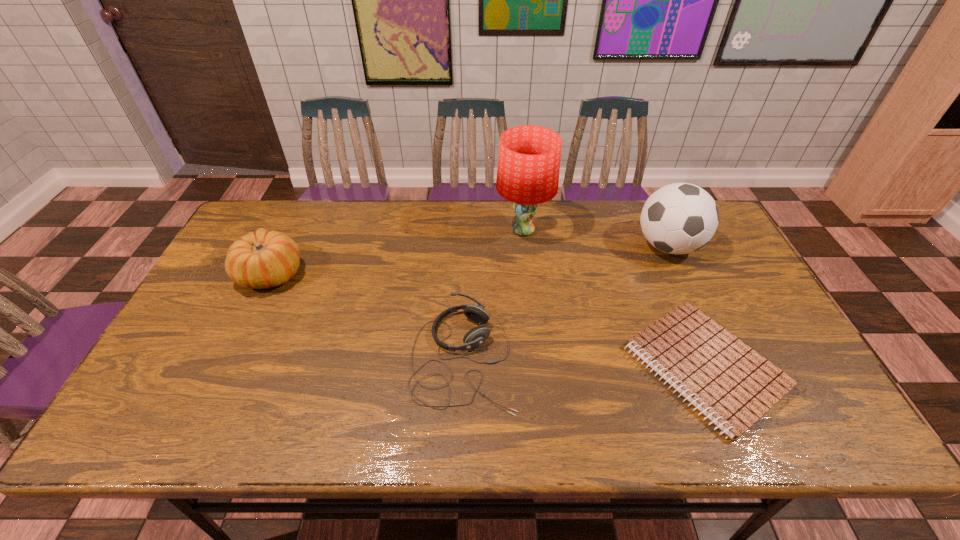
Locate an element on the screen. lampshade is located at coordinates (529, 158).

At what (x,y) coordinates should I click in order to perform the action: click on soccer ball. Please return your answer as a coordinate pair (x, y). This screenshot has height=540, width=960. Looking at the image, I should click on (680, 218).

Identify the location of the third tallest object. The height and width of the screenshot is (540, 960). (264, 259).

Image resolution: width=960 pixels, height=540 pixels. Find the location of `gourd`. gourd is located at coordinates (264, 259).

The width and height of the screenshot is (960, 540). Find the location of `headset`. headset is located at coordinates (478, 335).

You are a GUI agent. You are given a task and a screenshot of the screen. Output one action in this format:
    pyautogui.click(x=<x>, y=<y>)
    Task: Click on the notebook
    The height and width of the screenshot is (540, 960).
    Given the screenshot: What is the action you would take?
    pyautogui.click(x=732, y=385)

Where is `vacant space located on the front-facing side of the tallest object`? This screenshot has width=960, height=540. vacant space located on the front-facing side of the tallest object is located at coordinates (420, 230).

I want to click on vacant space located on the front-facing side of the tallest object, so click(x=441, y=230).

Identify the location of free spot located 0.140m on the front-facing side of the tallest object. (452, 230).

Where is `vacant space located on the left of the soccer ball`? The image size is (960, 540). vacant space located on the left of the soccer ball is located at coordinates (571, 246).